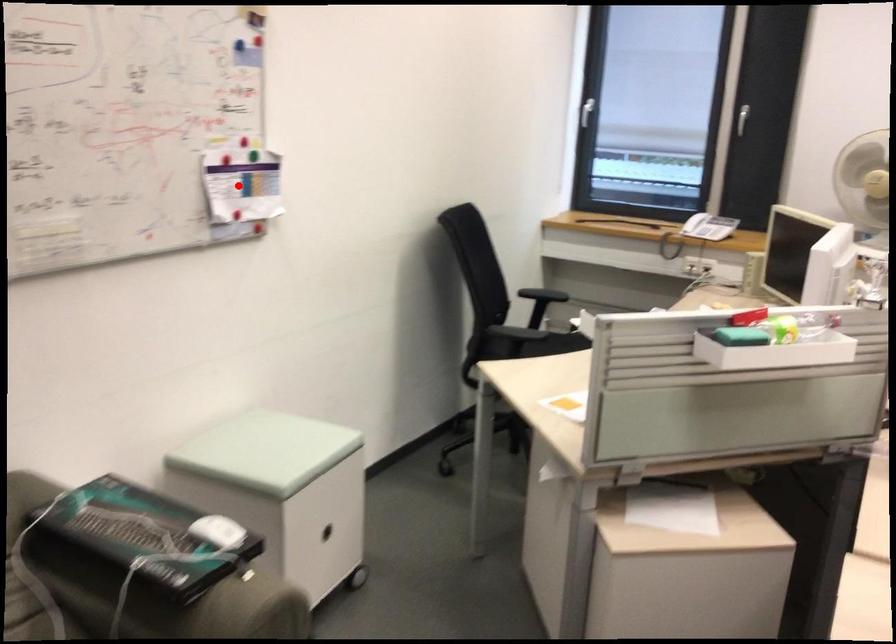
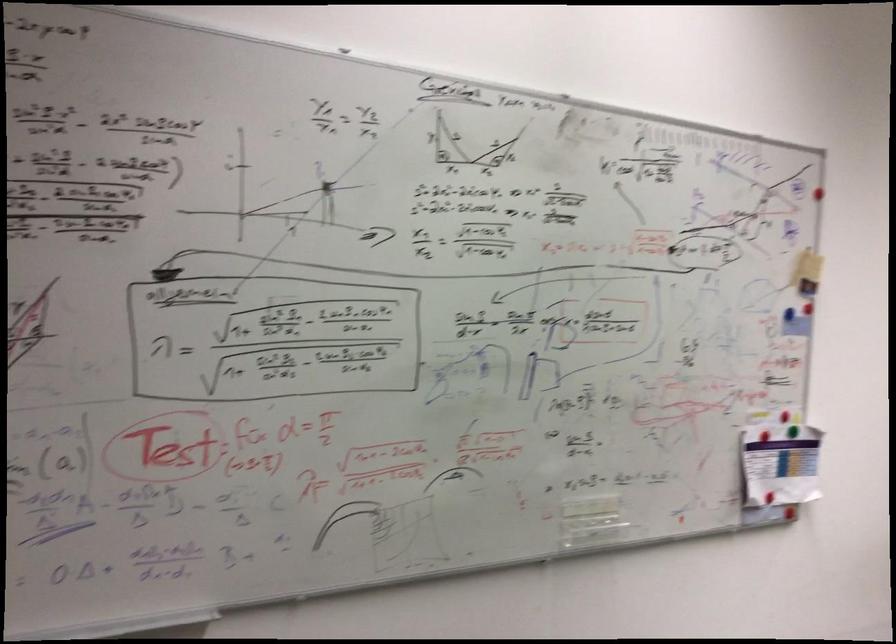
Where in the second image is the point corresponding to the highlighted location from the first image?

(780, 464)